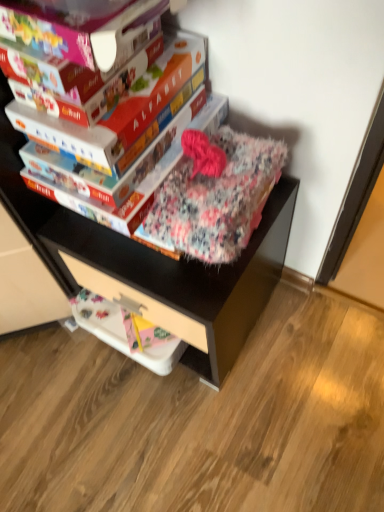
Where is `vacant space to the right of fluffy fabric bag at upper center`? This screenshot has height=512, width=384. vacant space to the right of fluffy fabric bag at upper center is located at coordinates (312, 335).